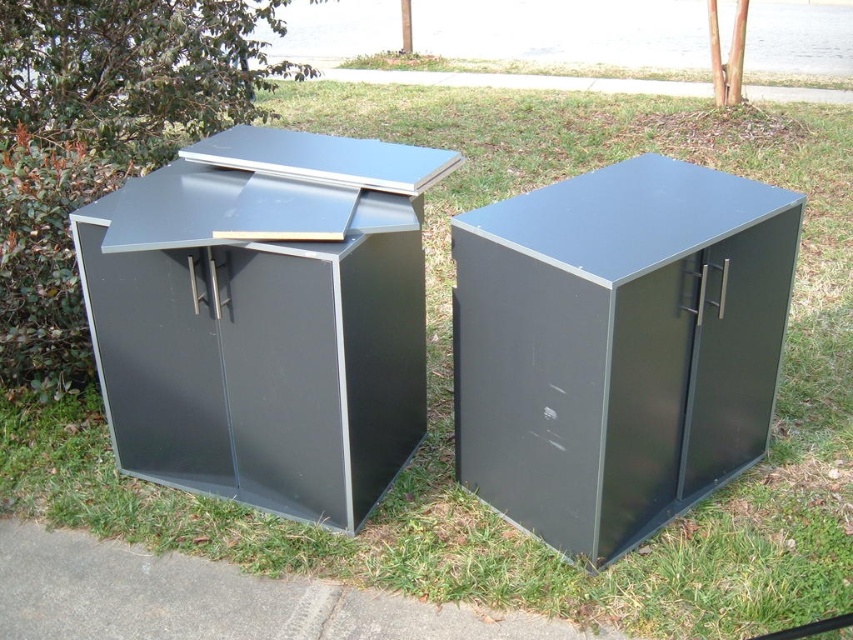
Between matte black cabinet at center and gray concrete pavement at lower left, which one appears on the right side from the viewer's perspective?

From the viewer's perspective, matte black cabinet at center appears more on the right side.

Between point (459, 422) and point (67, 564), which one is positioned in front?

Positioned in front is point (67, 564).

This screenshot has height=640, width=853. What are the coordinates of `matte black cabinet at center` in the screenshot? It's located at (618, 346).

Is matte black cabinet at left taller than gray concrete pavement at lower left?

Yes.

Is matte black cabinet at left smaller than gray concrete pavement at lower left?

Incorrect, matte black cabinet at left is not smaller in size than gray concrete pavement at lower left.

Find the location of a particular element. matte black cabinet at left is located at coordinates (264, 317).

Where is `matte black cabinet at left`? matte black cabinet at left is located at coordinates (264, 317).

Who is taller, matte black cabinet at left or matte black cabinet at center?

With more height is matte black cabinet at left.

Between matte black cabinet at left and matte black cabinet at center, which one has less height?

matte black cabinet at center is shorter.

Which is in front, point (332, 515) or point (686, 205)?

Positioned in front is point (686, 205).

At what (x,y) coordinates should I click in order to perform the action: click on matte black cabinet at left. Please return your answer as a coordinate pair (x, y). The height and width of the screenshot is (640, 853). Looking at the image, I should click on (264, 317).